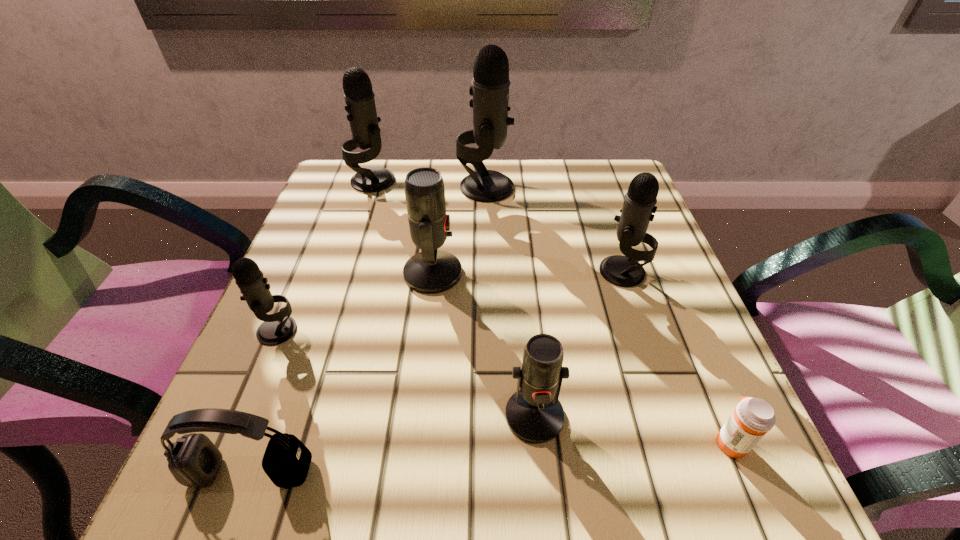
Locate an element on the screen. The image size is (960, 540). free space located 0.080m on the side of the nearer red microphone with the red ring is located at coordinates click(543, 505).

Where is `vacant space situated 0.130m on the left of the orange medicine`? Image resolution: width=960 pixels, height=540 pixels. vacant space situated 0.130m on the left of the orange medicine is located at coordinates (621, 442).

Image resolution: width=960 pixels, height=540 pixels. I want to click on headset present at the near edge, so click(194, 461).

What are the coordinates of `medicine that is at the near edge` in the screenshot? It's located at (753, 417).

Where is `headset present at the left edge`? This screenshot has width=960, height=540. headset present at the left edge is located at coordinates (194, 461).

Locate an element on the screen. Image resolution: width=960 pixels, height=540 pixels. microphone that is positioned at the right edge is located at coordinates (640, 200).

Identify the location of medicine that is positioned at the right edge. The width and height of the screenshot is (960, 540). (753, 417).

Image resolution: width=960 pixels, height=540 pixels. In order to click on object at the far left corner in this screenshot , I will do `click(360, 105)`.

Find the location of a particular element. object at the near left corner is located at coordinates (194, 461).

Identify the location of object positioned at the near right corner. (753, 417).